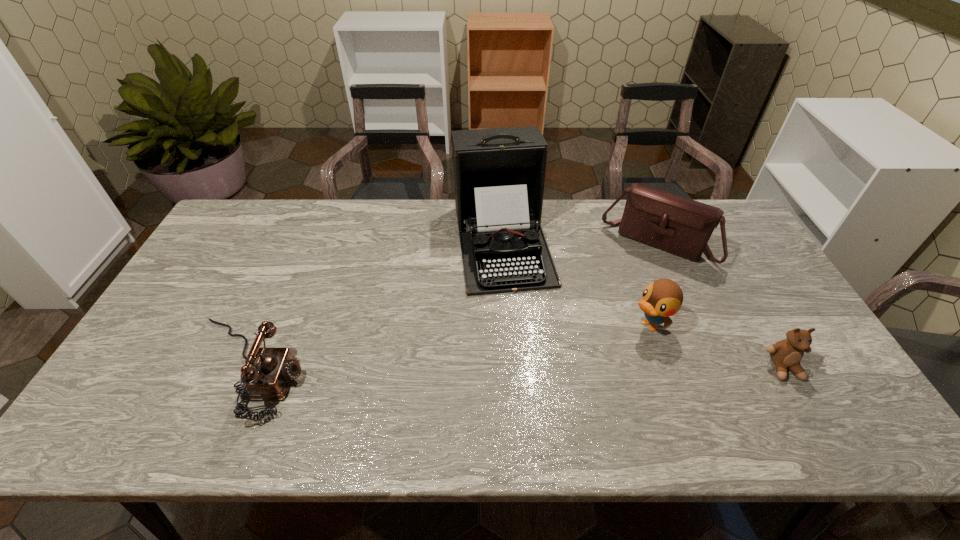
Find the location of a particular element. The height and width of the screenshot is (540, 960). object present at the left edge is located at coordinates (268, 378).

The image size is (960, 540). I want to click on teddy bear present at the right edge, so click(x=786, y=354).

The image size is (960, 540). I want to click on shoulder bag present at the right edge, so click(x=672, y=223).

Where is `object that is at the near left corner`? object that is at the near left corner is located at coordinates (268, 378).

Where is `object at the far right corner`? object at the far right corner is located at coordinates (672, 223).

Identify the location of object that is positioned at the near right corner. (786, 354).

Locate an element on the screen. The height and width of the screenshot is (540, 960). vacant area at the far edge of the desktop is located at coordinates (352, 215).

Where is `vacant space at the near edge of the desktop`? The width and height of the screenshot is (960, 540). vacant space at the near edge of the desktop is located at coordinates (590, 393).

Find the location of a particular element. The width and height of the screenshot is (960, 540). free space at the left edge of the desktop is located at coordinates (147, 340).

This screenshot has width=960, height=540. Find the location of `vacant area at the near right corner`. vacant area at the near right corner is located at coordinates (816, 388).